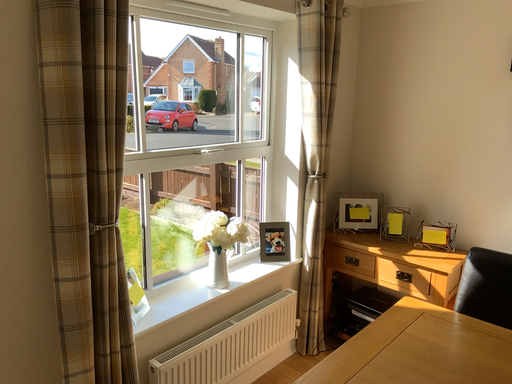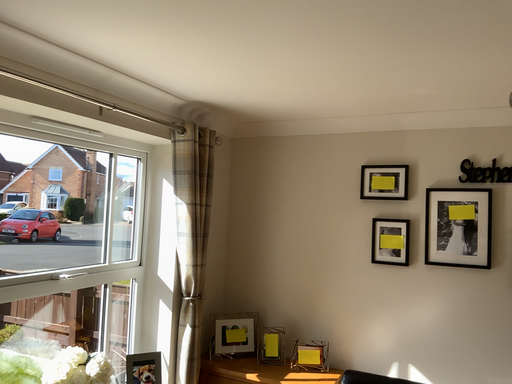
Question: Which way did the camera rotate in the video?

Choices:
 (A) rotated upward
 (B) rotated downward

Answer: (A)